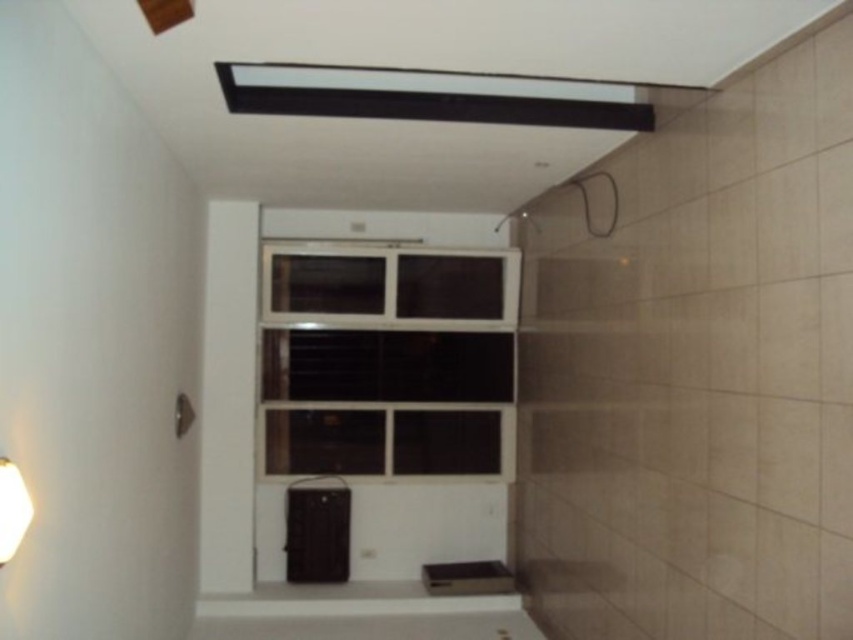
Does clear glass window at center have a smaller size compared to white glossy bath at lower center?

No.

Which of these two, clear glass window at center or white glossy bath at lower center, stands shorter?

With less height is white glossy bath at lower center.

Is point (265, 436) positioned after point (415, 618)?

Yes.

Identify the location of clear glass window at center. The width and height of the screenshot is (853, 640). (381, 355).

Does point (433, 636) lie behind point (10, 464)?

Yes, it is behind point (10, 464).

Measure the distance from white glossy bath at lower center to white matte lampshade at lower left.

A distance of 3.17 meters exists between white glossy bath at lower center and white matte lampshade at lower left.

Does point (374, 634) come farther from viewer compared to point (16, 532)?

Yes, it is behind point (16, 532).

This screenshot has height=640, width=853. Identify the location of white glossy bath at lower center. (372, 627).

You are a GUI agent. You are given a task and a screenshot of the screen. Output one action in this format:
    pyautogui.click(x=<x>, y=<y>)
    Task: Click on the clear glass window at center
    The height and width of the screenshot is (640, 853).
    Given the screenshot: What is the action you would take?
    pyautogui.click(x=381, y=355)

What do you see at coordinates (381, 355) in the screenshot? Image resolution: width=853 pixels, height=640 pixels. I see `clear glass window at center` at bounding box center [381, 355].

What do you see at coordinates (381, 355) in the screenshot? The height and width of the screenshot is (640, 853). I see `clear glass window at center` at bounding box center [381, 355].

I want to click on clear glass window at center, so click(381, 355).